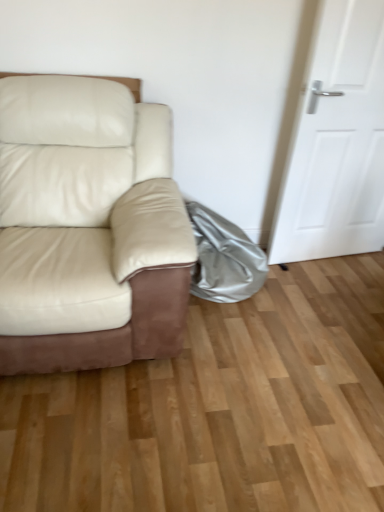
The height and width of the screenshot is (512, 384). Identify the location of free location to the right of shiny metallic bag at lower right. (316, 293).